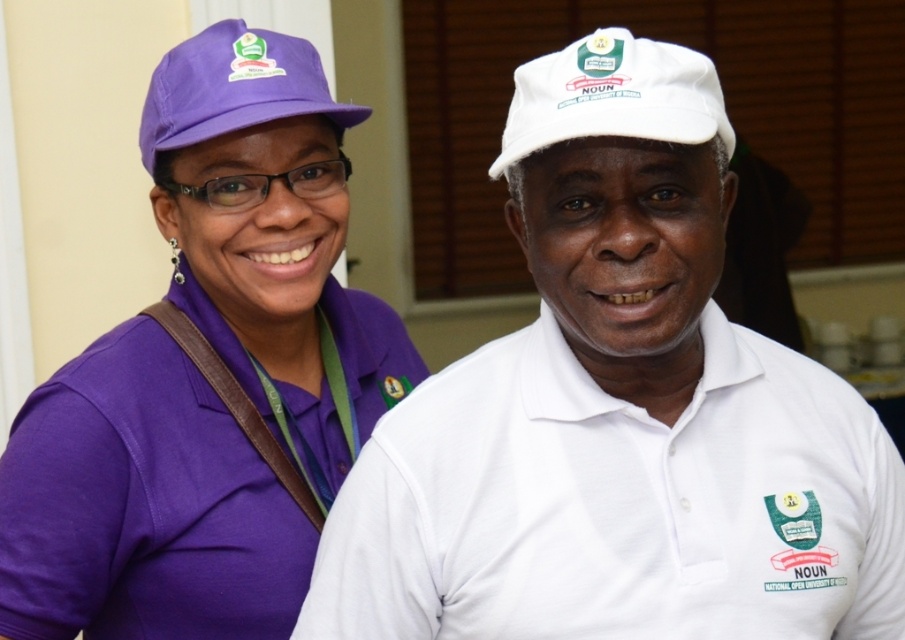
Between matte purple cap at upper left and matte purple baseball cap at upper left, which one appears on the right side from the viewer's perspective?

matte purple cap at upper left

How distant is matte purple cap at upper left from matte purple baseball cap at upper left?

15.40 centimeters

Which is in front, point (110, 445) or point (262, 29)?

Point (110, 445) is more forward.

You are a GUI agent. You are given a task and a screenshot of the screen. Output one action in this format:
    pyautogui.click(x=<x>, y=<y>)
    Task: Click on the matte purple cap at upper left
    
    Given the screenshot: What is the action you would take?
    pyautogui.click(x=272, y=241)

Can you confirm if white matte cap at upper center is positioned to the right of matte purple baseball cap at upper left?

Correct, you'll find white matte cap at upper center to the right of matte purple baseball cap at upper left.

Is white matte cap at upper center thinner than matte purple baseball cap at upper left?

In fact, white matte cap at upper center might be wider than matte purple baseball cap at upper left.

Does point (519, 170) come closer to viewer compared to point (237, 116)?

Yes, it is in front of point (237, 116).

I want to click on white matte cap at upper center, so click(x=618, y=412).

Is white matte cap at upper center to the left of white matte baseball cap at upper center from the viewer's perspective?

No, white matte cap at upper center is not to the left of white matte baseball cap at upper center.

Does white matte cap at upper center have a greater width compared to white matte baseball cap at upper center?

Correct, the width of white matte cap at upper center exceeds that of white matte baseball cap at upper center.

Who is more forward, (402, 420) or (658, 131)?

Point (658, 131)

This screenshot has height=640, width=905. I want to click on white matte cap at upper center, so pos(618,412).